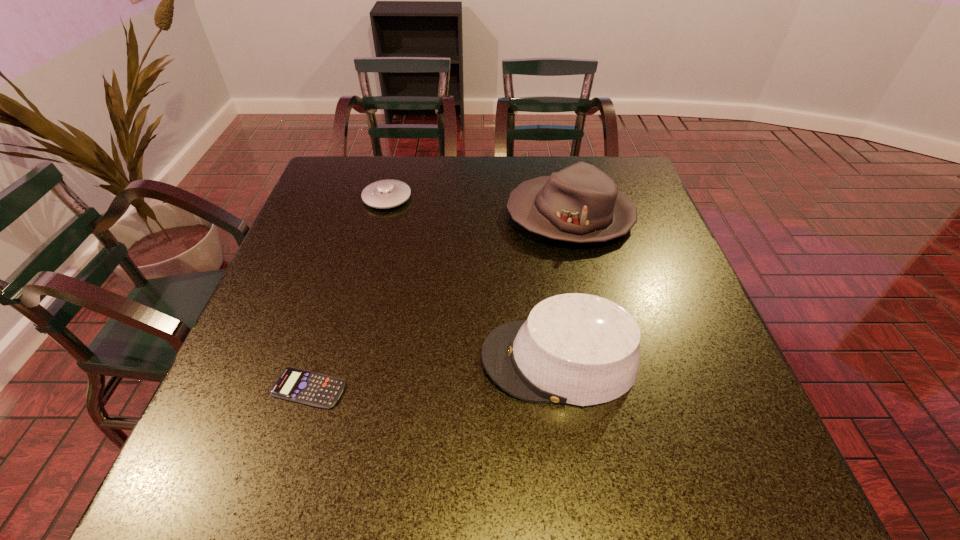
Identify the location of object located at the far right corner. (580, 203).

The height and width of the screenshot is (540, 960). I want to click on vacant space at the far edge, so click(556, 158).

Where is `free space at the near edge`? The height and width of the screenshot is (540, 960). free space at the near edge is located at coordinates (387, 475).

Find the location of `vacant space at the left edge of the desktop`. vacant space at the left edge of the desktop is located at coordinates (315, 244).

Identify the location of vacant space at the right edge of the desktop. This screenshot has height=540, width=960. (643, 345).

Image resolution: width=960 pixels, height=540 pixels. In order to click on free space at the far left corner of the desktop in this screenshot , I will do `click(359, 174)`.

I want to click on empty location between the nearer hat and the taller hat, so click(x=564, y=288).

You are a GUI agent. You are given a task and a screenshot of the screen. Output one action in this format:
    pyautogui.click(x=<x>, y=<y>)
    Task: Click on the vacant region between the saucer and the farther hat
    The image size is (960, 540).
    Given the screenshot: What is the action you would take?
    pyautogui.click(x=479, y=207)

Locate an element on the screen. The width and height of the screenshot is (960, 540). vacant area between the third tallest object and the third shortest object is located at coordinates (473, 279).

This screenshot has height=540, width=960. In order to click on vacant area between the calculator and the farther hat in this screenshot , I will do `click(440, 302)`.